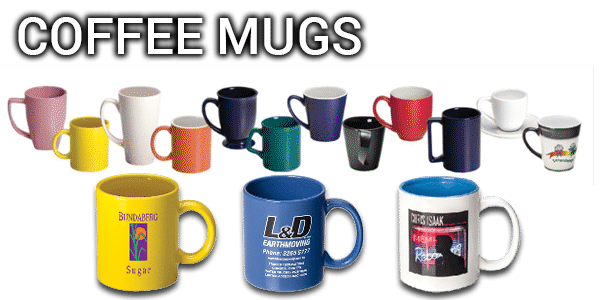
Locate an element on the screen. white mug with blue inside is located at coordinates (461, 227).